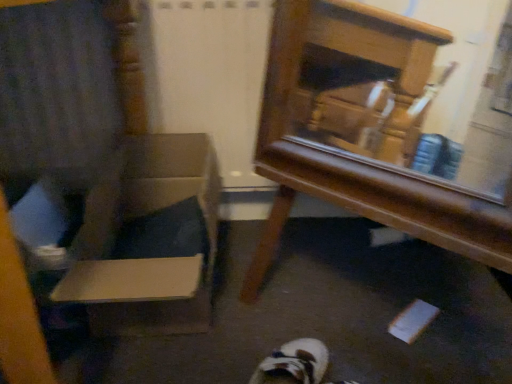
Question: Is wooden mirror at center smaller than cardboard box at left?

Choices:
 (A) yes
 (B) no

Answer: (B)

Question: Are wooden mirror at center and cardboard box at left beside each other?

Choices:
 (A) no
 (B) yes

Answer: (A)

Question: Does wooden mirror at center have a lesser height compared to cardboard box at left?

Choices:
 (A) yes
 (B) no

Answer: (B)

Question: Is wooden mirror at center outside cardboard box at left?

Choices:
 (A) no
 (B) yes

Answer: (B)

Question: Does wooden mirror at center have a greater width compared to cardboard box at left?

Choices:
 (A) no
 (B) yes

Answer: (A)

Question: From a real-world perspective, is wooden mirror at center physically below cardboard box at left?

Choices:
 (A) no
 (B) yes

Answer: (A)

Question: From the image's perspective, does cardboard box at left appear higher than wooden armchair at left?

Choices:
 (A) yes
 (B) no

Answer: (B)

Question: Is the position of cardboard box at left more distant than that of wooden armchair at left?

Choices:
 (A) no
 (B) yes

Answer: (B)

Question: Is cardboard box at left positioned before wooden armchair at left?

Choices:
 (A) no
 (B) yes

Answer: (A)

Question: Is cardboard box at left to the left of wooden armchair at left from the viewer's perspective?

Choices:
 (A) yes
 (B) no

Answer: (B)

Question: Is there a large distance between cardboard box at left and wooden armchair at left?

Choices:
 (A) yes
 (B) no

Answer: (B)

Question: Is cardboard box at left smaller than wooden armchair at left?

Choices:
 (A) yes
 (B) no

Answer: (A)

Question: Can you confirm if wooden armchair at left is shorter than cardboard box at left?

Choices:
 (A) yes
 (B) no

Answer: (B)